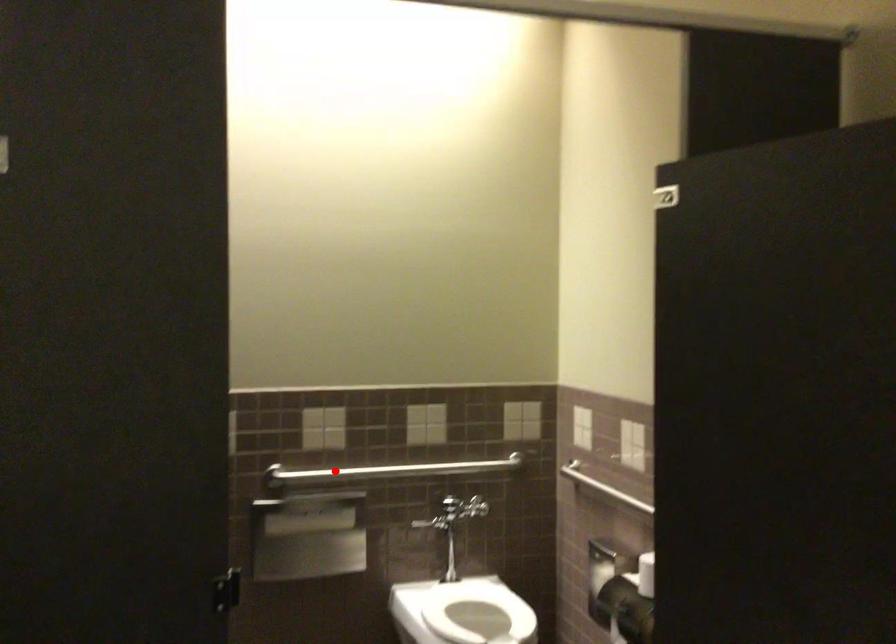
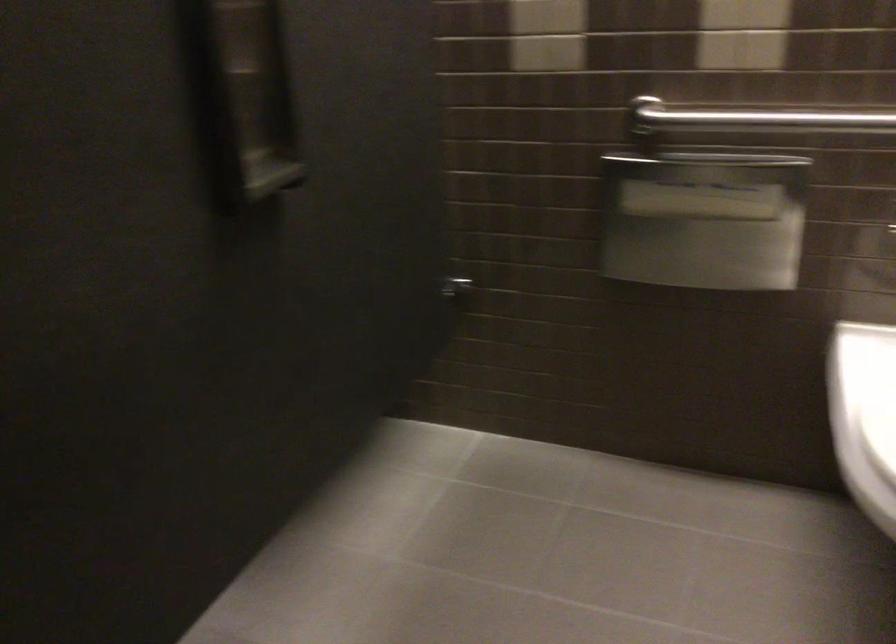
The point at the highlighted location is marked in the first image. Where is the corresponding point in the second image?

(751, 116)